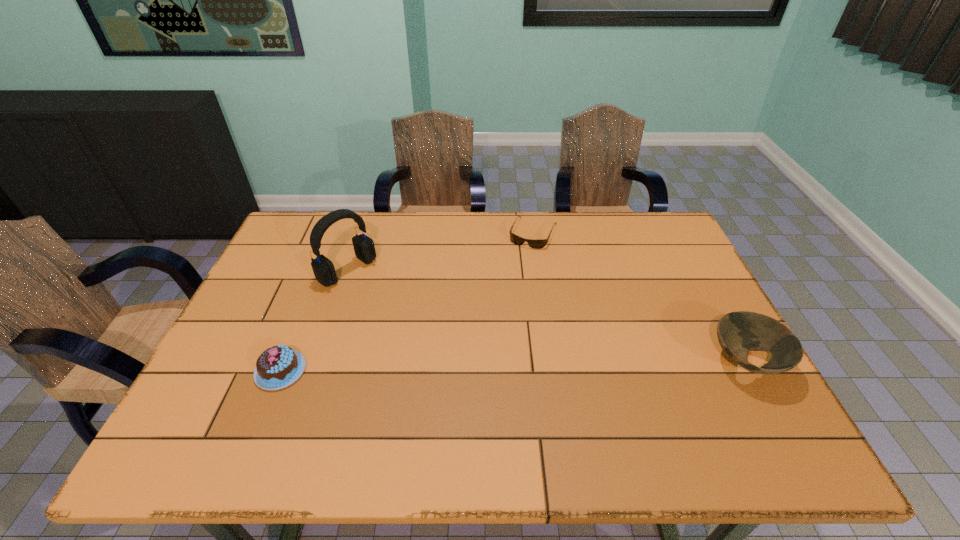
I want to click on the second closest object to the second tallest object, so click(324, 271).

This screenshot has width=960, height=540. I want to click on vacant space that satisfies the following two spatial constraints: 1. on the front side of the shortest object; 2. on the right side of the rightmost object, so click(x=553, y=362).

Where is `free space that satisfies the following two spatial constraints: 1. on the front side of the tallest object; 2. on the right side of the second tallest object`? The image size is (960, 540). free space that satisfies the following two spatial constraints: 1. on the front side of the tallest object; 2. on the right side of the second tallest object is located at coordinates (317, 362).

The image size is (960, 540). What are the coordinates of `vacant point that satisfies the following two spatial constraints: 1. on the front side of the rightmost object; 2. on the left side of the tallest object` in the screenshot? It's located at (317, 362).